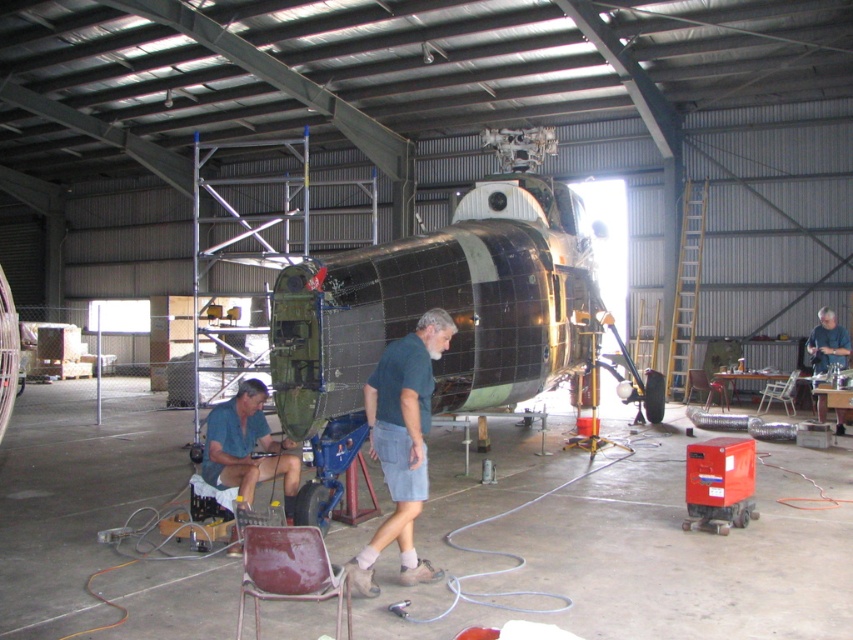
Question: Which object appears closest to the camera in this image?

Choices:
 (A) dark green shirt at center
 (B) brushed metal shirt at lower left
 (C) metallic maroon chair at lower center

Answer: (C)

Question: Which point appears closest to the camera in this image?

Choices:
 (A) (347, 604)
 (B) (378, 541)

Answer: (A)

Question: Which object appears closest to the camera in this image?

Choices:
 (A) metallic maroon chair at lower center
 (B) brown leather chair at center

Answer: (A)

Question: Can you confirm if dark green shirt at center is positioned to the right of metallic gray chair at center?

Choices:
 (A) yes
 (B) no

Answer: (B)

Question: Is metallic green helicopter at center to the right of metallic gray chair at center from the viewer's perspective?

Choices:
 (A) yes
 (B) no

Answer: (B)

Question: Can you confirm if metallic maroon chair at lower center is thinner than metallic gray chair at center?

Choices:
 (A) yes
 (B) no

Answer: (A)